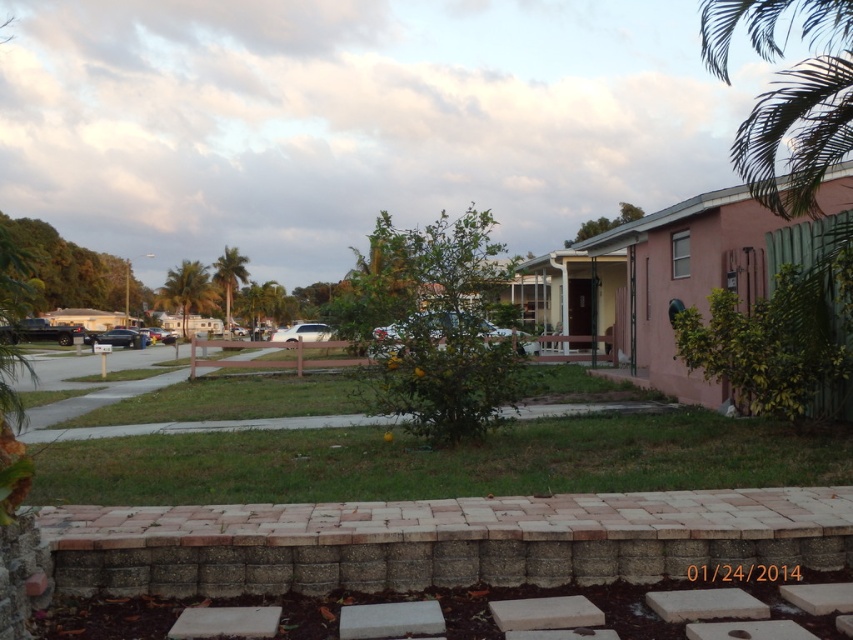
Is point (480, 474) less distant than point (274, 292)?

Yes.

This screenshot has width=853, height=640. In order to click on green grass at center in this screenshot , I will do `click(444, 461)`.

Which is in front, point (131, 474) or point (254, 324)?

Point (131, 474) is in front.

The height and width of the screenshot is (640, 853). Find the location of `green grass at center`. green grass at center is located at coordinates (444, 461).

Based on the photo, is green grass at center behind green leafy palm tree at left?

No, green grass at center is closer to the viewer.

Can you confirm if green grass at center is smaller than green leafy palm tree at left?

Yes, green grass at center is smaller than green leafy palm tree at left.

Is point (508, 428) in front of point (219, 269)?

Yes, point (508, 428) is in front of point (219, 269).

I want to click on green grass at center, so click(444, 461).

Does green leafy palm tree at center lie behind green leafy palm tree at left?

No, it is in front of green leafy palm tree at left.

Is green leafy palm tree at center smaller than green leafy palm tree at left?

Yes.

Describe the element at coordinates (259, 305) in the screenshot. I see `green leafy palm tree at center` at that location.

Identify the location of green leafy palm tree at center. pos(259,305).